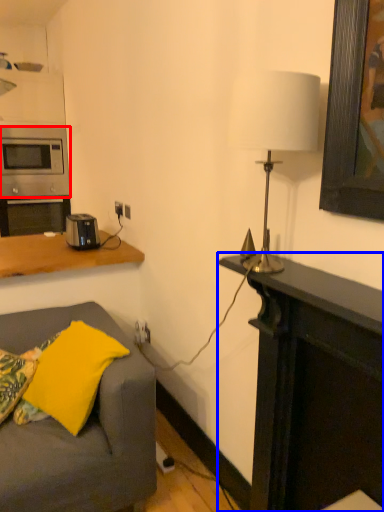
Question: Which object is closer to the camera taking this photo, microwave oven (highlighted by a red box) or desk (highlighted by a blue box)?

Choices:
 (A) microwave oven
 (B) desk

Answer: (B)